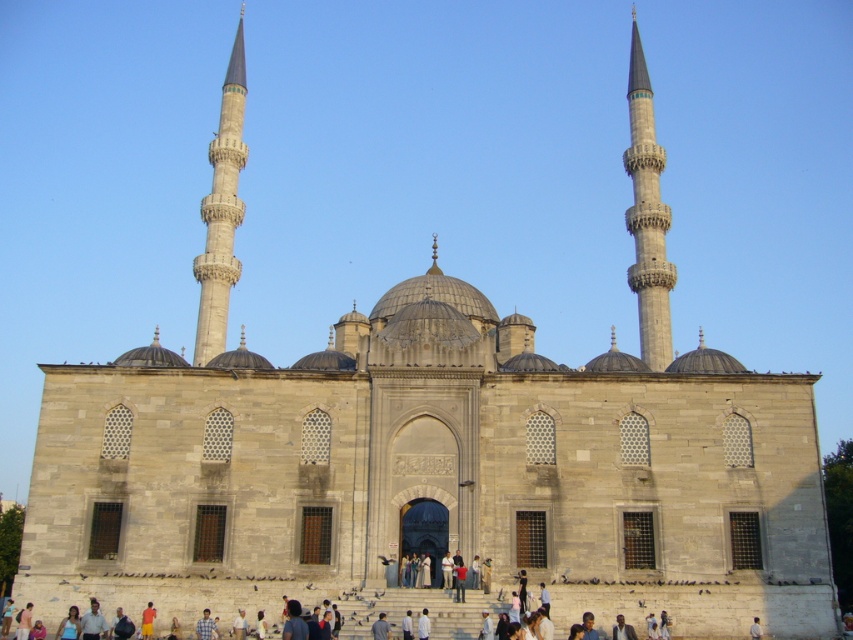
Question: Is gray stone minaret at right to the left of gray stone minaret at left from the viewer's perspective?

Choices:
 (A) yes
 (B) no

Answer: (B)

Question: In this image, where is gray stone minaret at right located relative to gray stone minaret at left?

Choices:
 (A) above
 (B) below

Answer: (A)

Question: Can you confirm if gray stone minaret at right is positioned below gray stone minaret at left?

Choices:
 (A) no
 (B) yes

Answer: (A)

Question: Which object appears closest to the camera in this image?

Choices:
 (A) gray stone minaret at right
 (B) gray stone minaret at left

Answer: (B)

Question: Which object is farther from the camera taking this photo?

Choices:
 (A) gray stone minaret at left
 (B) gray stone minaret at right

Answer: (B)